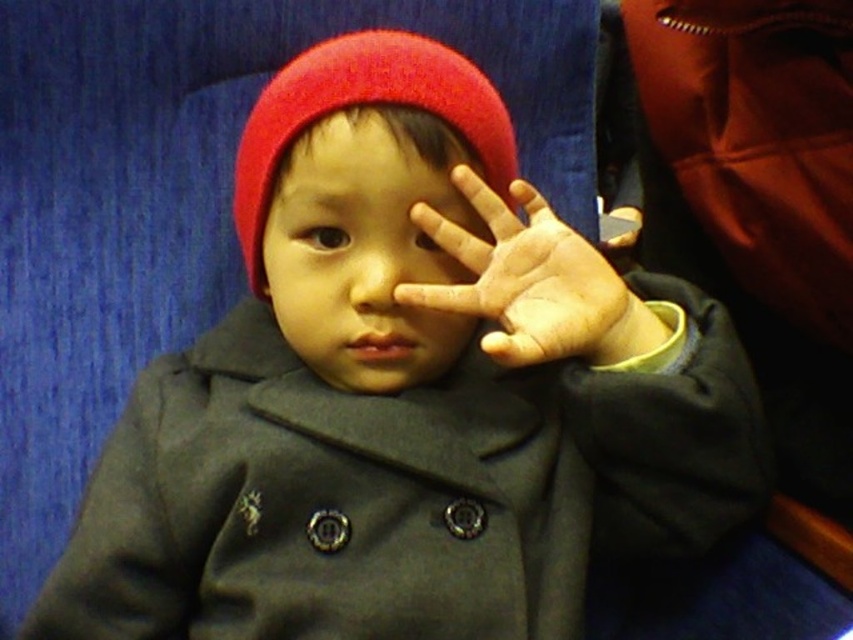
You are taking a photo of the child and want to focus on two specific points in the image. The points are labeled as point (387, 353) and point (482, 148). Which point is closer to the camera?

Point (387, 353) is closer to the camera than point (482, 148).

You are a fashion designer trying to decide which hat to feature in your winter collection. You have two options from the image provided. Which hat is thinner between the matte red beanie at center and the red woolen hat at center?

The matte red beanie at center is thinner than the red woolen hat at center according to the description.

You are a healthcare professional examining the image of the child. You need to locate the dry skin palm at center. Where exactly is it located in terms of coordinates?

The dry skin palm at center is located at coordinates point (531, 282).